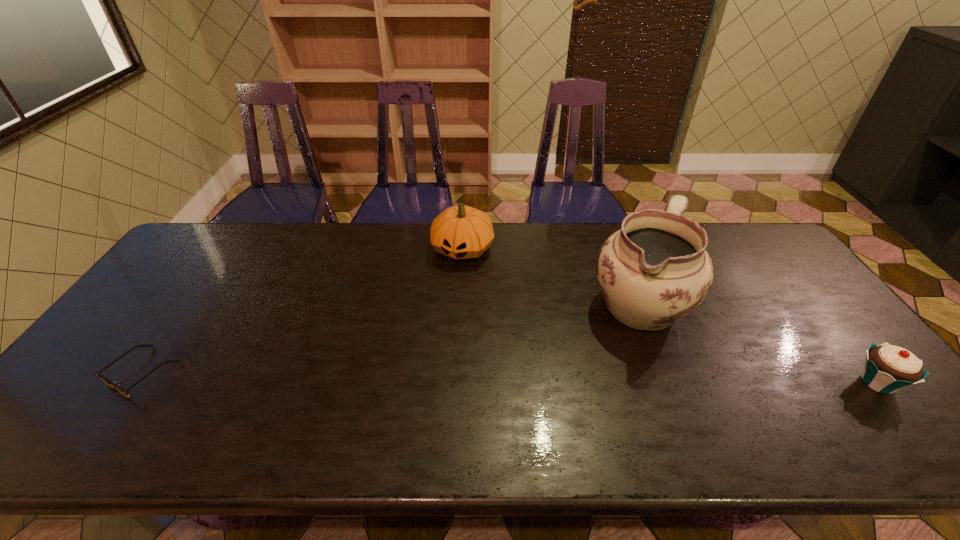
This screenshot has height=540, width=960. I want to click on sunglasses, so pos(109,382).

You are a GUI agent. You are given a task and a screenshot of the screen. Output one action in this format:
    pyautogui.click(x=<x>, y=<y>)
    Task: Click on the leftmost object
    
    Given the screenshot: What is the action you would take?
    pyautogui.click(x=109, y=382)

Image resolution: width=960 pixels, height=540 pixels. In order to click on the second shortest object in this screenshot , I will do pyautogui.click(x=888, y=368).

You are a GUI agent. You are given a task and a screenshot of the screen. Output one action in this format:
    pyautogui.click(x=<x>, y=<y>)
    Task: Click on the rightmost object
    This screenshot has width=960, height=540.
    Given the screenshot: What is the action you would take?
    pyautogui.click(x=888, y=368)

Identify the location of gourd. The image size is (960, 540). (461, 232).

Image resolution: width=960 pixels, height=540 pixels. In order to click on the second tallest object in this screenshot , I will do `click(461, 232)`.

The width and height of the screenshot is (960, 540). What are the coordinates of `pitcher` in the screenshot? It's located at (654, 271).

I want to click on the second object from right to left, so click(654, 271).

Image resolution: width=960 pixels, height=540 pixels. In order to click on free space located 0.400m on the back of the rightmost object in this screenshot , I will do `click(781, 264)`.

I want to click on free location located 0.190m on the side of the second object from left to right with the carved face, so click(438, 310).